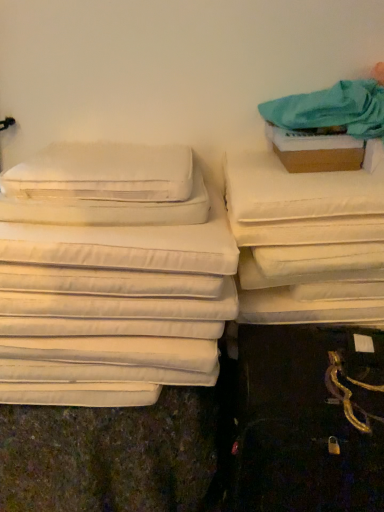
Question: Is the position of white fabric mattress at right more distant than that of white soft pillow at left, the second pillow from the top?

Choices:
 (A) no
 (B) yes

Answer: (B)

Question: Is white fabric mattress at right not near white soft pillow at left, the second pillow from the top?

Choices:
 (A) no
 (B) yes

Answer: (A)

Question: Is white fabric mattress at right facing away from white soft pillow at left, the second pillow from the top?

Choices:
 (A) yes
 (B) no

Answer: (B)

Question: Is white fabric mattress at right smaller than white soft pillow at left, the 1th pillow positioned from the bottom?

Choices:
 (A) yes
 (B) no

Answer: (A)

Question: Is white soft pillow at left, the second pillow from the top, a part of white fabric mattress at right?

Choices:
 (A) no
 (B) yes

Answer: (A)

Question: Considering the positions of white fabric mattress at right and teal fabric at upper right in the image, is white fabric mattress at right wider or thinner than teal fabric at upper right?

Choices:
 (A) wide
 (B) thin

Answer: (A)

Question: Is white fabric mattress at right inside the boundaries of teal fabric at upper right, or outside?

Choices:
 (A) inside
 (B) outside

Answer: (B)

Question: Relative to teal fabric at upper right, is white fabric mattress at right in front or behind?

Choices:
 (A) front
 (B) behind

Answer: (B)

Question: From a real-world perspective, is white fabric mattress at right physically located above or below teal fabric at upper right?

Choices:
 (A) above
 (B) below

Answer: (B)

Question: Relative to white soft pillow at left, the second pillow from the top, is white soft pillow at upper left, the 1th pillow viewed from the top, in front or behind?

Choices:
 (A) front
 (B) behind

Answer: (B)

Question: Is white soft pillow at upper left, the 1th pillow viewed from the top, situated inside white soft pillow at left, the 1th pillow positioned from the bottom, or outside?

Choices:
 (A) inside
 (B) outside

Answer: (A)

Question: Considering the positions of point (185, 195) and point (188, 212), is point (185, 195) closer or farther from the camera than point (188, 212)?

Choices:
 (A) closer
 (B) farther

Answer: (B)

Question: Would you say white soft pillow at upper left, the 1th pillow viewed from the top, is to the left or to the right of white soft pillow at left, the 1th pillow positioned from the bottom, in the picture?

Choices:
 (A) right
 (B) left

Answer: (A)

Question: From a real-world perspective, is brown cardboard box at upper right physically located above or below white soft pillow at left, the 1th pillow positioned from the bottom?

Choices:
 (A) below
 (B) above

Answer: (B)

Question: Is point (350, 145) closer or farther from the camera than point (69, 211)?

Choices:
 (A) closer
 (B) farther

Answer: (B)